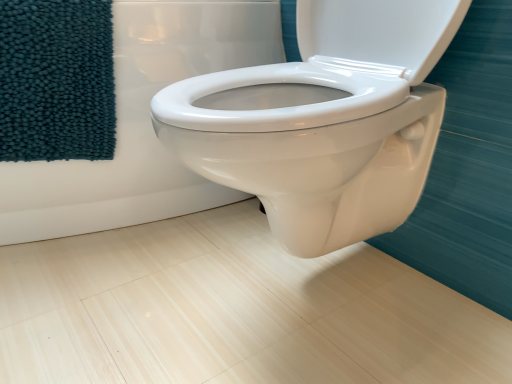
Question: Is white glossy toilet at center facing away from teal plush towel at left?

Choices:
 (A) yes
 (B) no

Answer: (B)

Question: From a real-world perspective, is white glossy toilet at center on top of teal plush towel at left?

Choices:
 (A) yes
 (B) no

Answer: (B)

Question: Can you confirm if white glossy toilet at center is thinner than teal plush towel at left?

Choices:
 (A) yes
 (B) no

Answer: (B)

Question: Is white glossy toilet at center positioned beyond the bounds of teal plush towel at left?

Choices:
 (A) yes
 (B) no

Answer: (A)

Question: Considering the relative positions of white glossy toilet at center and teal plush towel at left in the image provided, is white glossy toilet at center in front of teal plush towel at left?

Choices:
 (A) no
 (B) yes

Answer: (B)

Question: Is white glossy toilet at center bigger than teal plush towel at left?

Choices:
 (A) no
 (B) yes

Answer: (B)

Question: Does teal plush towel at left have a lesser width compared to white glossy toilet at center?

Choices:
 (A) yes
 (B) no

Answer: (A)

Question: Is teal plush towel at left next to white glossy toilet at center?

Choices:
 (A) yes
 (B) no

Answer: (B)

Question: Is teal plush towel at left shorter than white glossy toilet at center?

Choices:
 (A) yes
 (B) no

Answer: (A)

Question: From the image's perspective, is teal plush towel at left on white glossy toilet at center?

Choices:
 (A) no
 (B) yes

Answer: (A)

Question: Does teal plush towel at left lie in front of white glossy toilet at center?

Choices:
 (A) no
 (B) yes

Answer: (A)

Question: Considering the relative sizes of teal plush towel at left and white glossy toilet at center in the image provided, is teal plush towel at left smaller than white glossy toilet at center?

Choices:
 (A) yes
 (B) no

Answer: (A)

Question: From a real-world perspective, is teal plush towel at left physically located above or below white glossy toilet at center?

Choices:
 (A) above
 (B) below

Answer: (A)